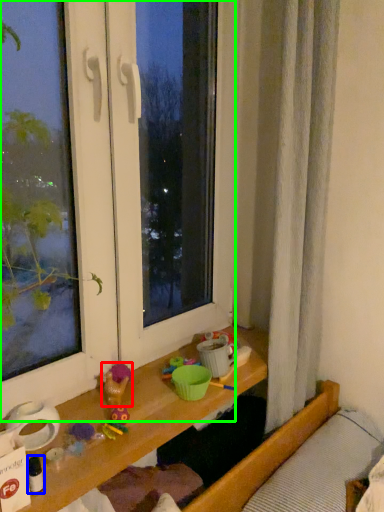
Question: Estimate the real-world distances between objects in this image. Which object is closer to toy (highlighted by a red box), toy (highlighted by a blue box) or window (highlighted by a green box)?

Choices:
 (A) toy
 (B) window

Answer: (A)